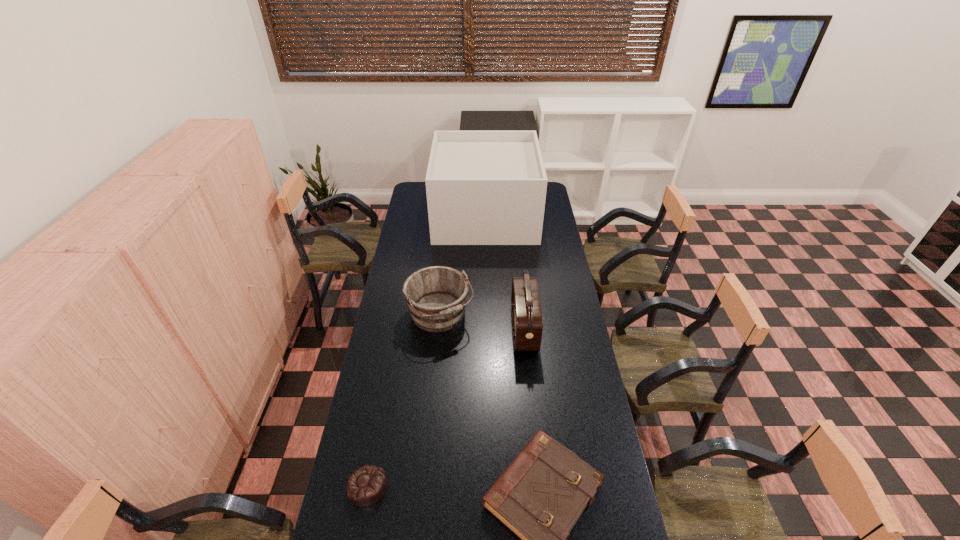
I want to click on vacant space located 0.160m on the front of the wine bucket, so 435,372.

Where is `vacant space located 0.060m on the front of the shortest object`? This screenshot has width=960, height=540. vacant space located 0.060m on the front of the shortest object is located at coordinates (359, 529).

The image size is (960, 540). Find the location of `object present at the far edge`. object present at the far edge is located at coordinates (483, 187).

Locate an element on the screen. This screenshot has height=540, width=960. wine bucket that is at the left edge is located at coordinates (436, 296).

This screenshot has height=540, width=960. Find the location of `beanbag positioned at the left edge`. beanbag positioned at the left edge is located at coordinates pos(366,486).

The width and height of the screenshot is (960, 540). Find the location of `object positioned at the right edge`. object positioned at the right edge is located at coordinates (483, 187).

Identify the location of object at the far right corner. click(x=483, y=187).

In the image, there is a desktop. At what (x,y) coordinates should I click in order to perform the action: click on vacant space at the left edge. Please return your answer as a coordinate pair (x, y). Looking at the image, I should click on (411, 218).

Where is `blank space at the right edge of the desktop`? blank space at the right edge of the desktop is located at coordinates (562, 299).

Find the location of a particular element. vacant region between the radio receiver and the shortest object is located at coordinates pos(445,408).